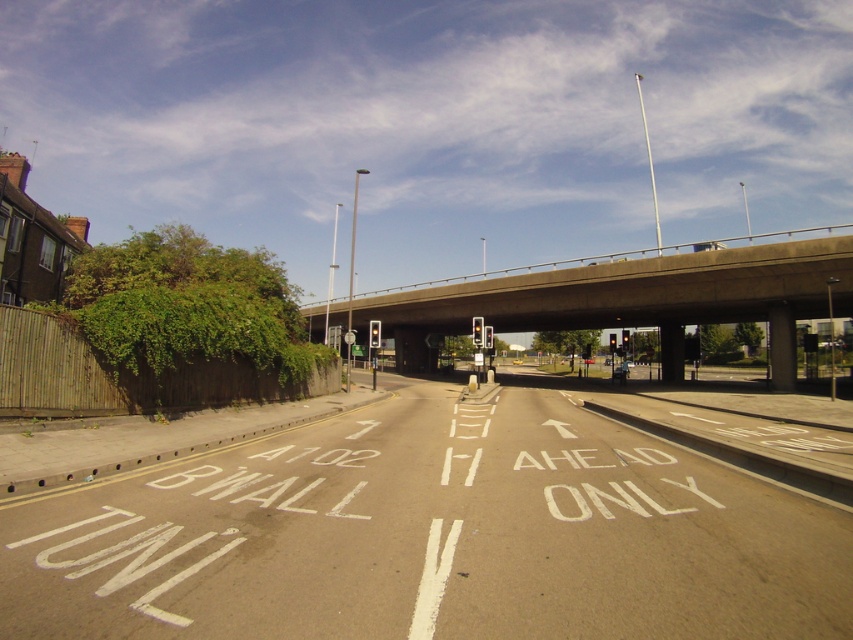
Question: Can you confirm if white asphalt road at center is smaller than concrete bridge at center?

Choices:
 (A) yes
 (B) no

Answer: (A)

Question: Does white asphalt road at center have a larger size compared to concrete bridge at center?

Choices:
 (A) no
 (B) yes

Answer: (A)

Question: Is white asphalt road at center positioned at the back of concrete bridge at center?

Choices:
 (A) no
 (B) yes

Answer: (A)

Question: Among these points, which one is farthest from the camera?

Choices:
 (A) (556, 588)
 (B) (596, 310)

Answer: (B)